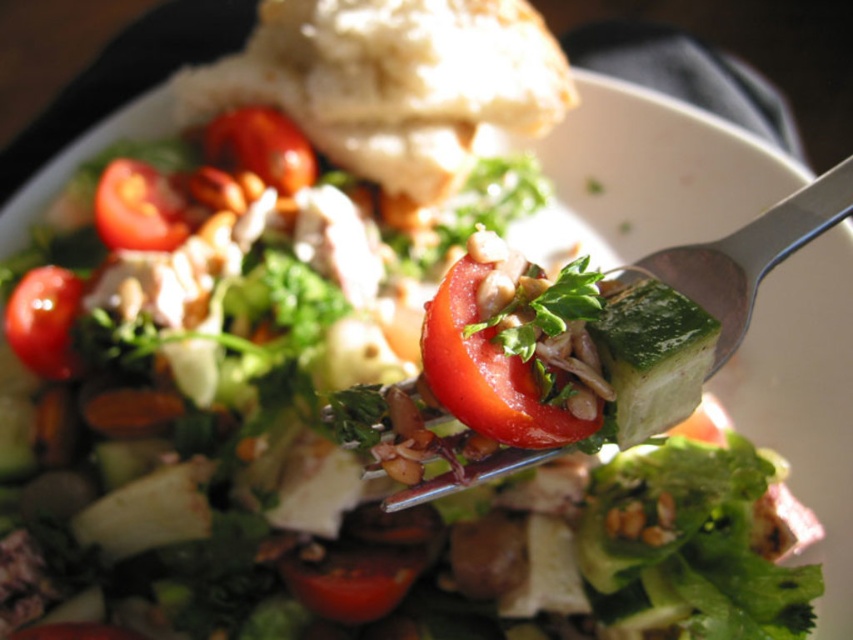
You are a drone trying to capture a photo of the salad. You need to position yourself so that the point at point (309, 154) is visible without being blocked by point (158, 192). Based on the scene description, which point should be closer to you to ensure the other is not blocked?

Point (158, 192) should be closer to you because point (309, 154) is behind it, so positioning yourself so that point (158, 192) is in front will allow the point (309, 154) to be visible behind it without obstruction.